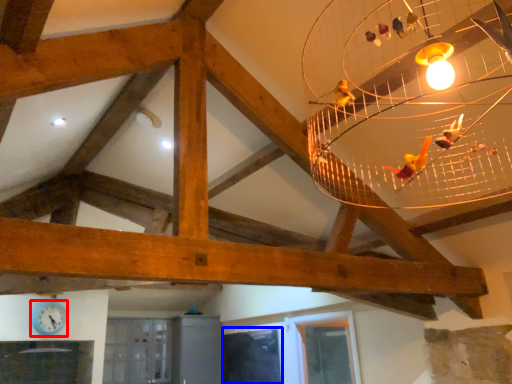
Question: Among these objects, which one is nearest to the camera, clock (highlighted by a red box) or window (highlighted by a blue box)?

Choices:
 (A) clock
 (B) window

Answer: (A)